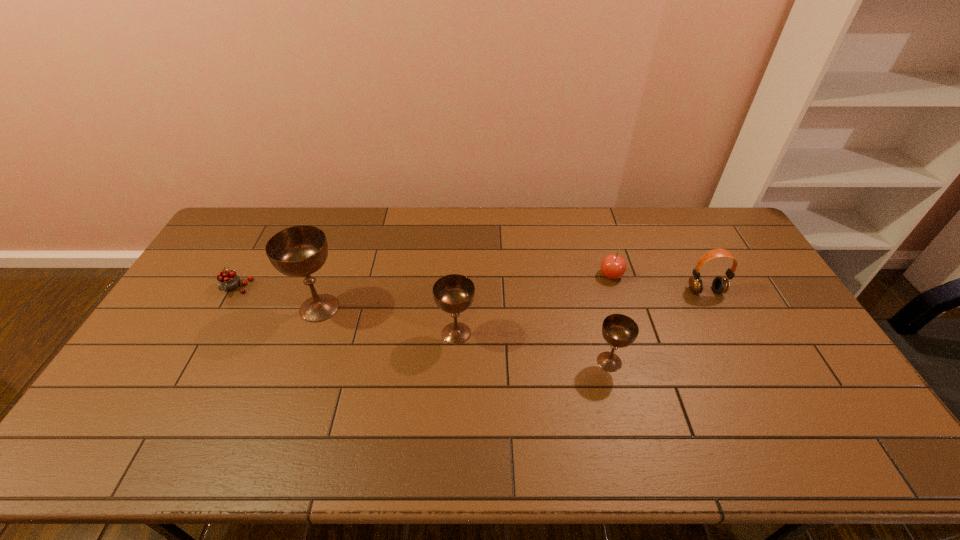
In order to click on chalice that is the closest to the tallest object in this screenshot , I will do `click(454, 293)`.

Identify which chalice is the second closest to the tallest chalice. Please provide its 2D coordinates. Your answer should be formatted as a tuple, i.e. [(x, y)], where the tuple contains the x and y coordinates of a point satisfying the conditions above.

[(618, 330)]

At what (x,y) coordinates should I click in order to perform the action: click on vacant space that satisfies the following two spatial constraints: 1. on the handle side of the leftmost object; 2. on the left side of the shortest chalice. Please return your answer as a coordinate pair (x, y). The width and height of the screenshot is (960, 540). Looking at the image, I should click on (194, 362).

Locate an element on the screen. This screenshot has width=960, height=540. vacant position in the image that satisfies the following two spatial constraints: 1. on the back side of the apple; 2. on the right side of the second chalice from right to left is located at coordinates (459, 275).